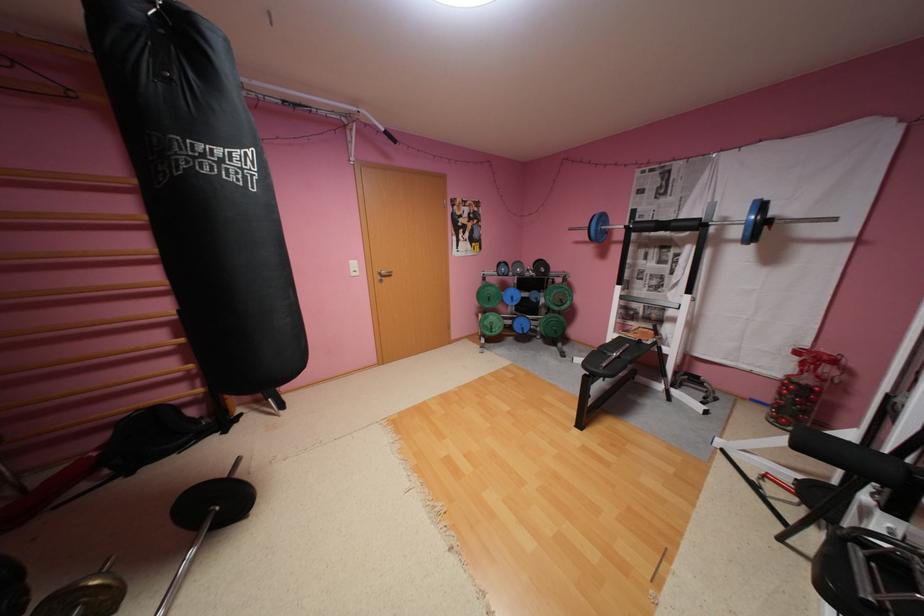
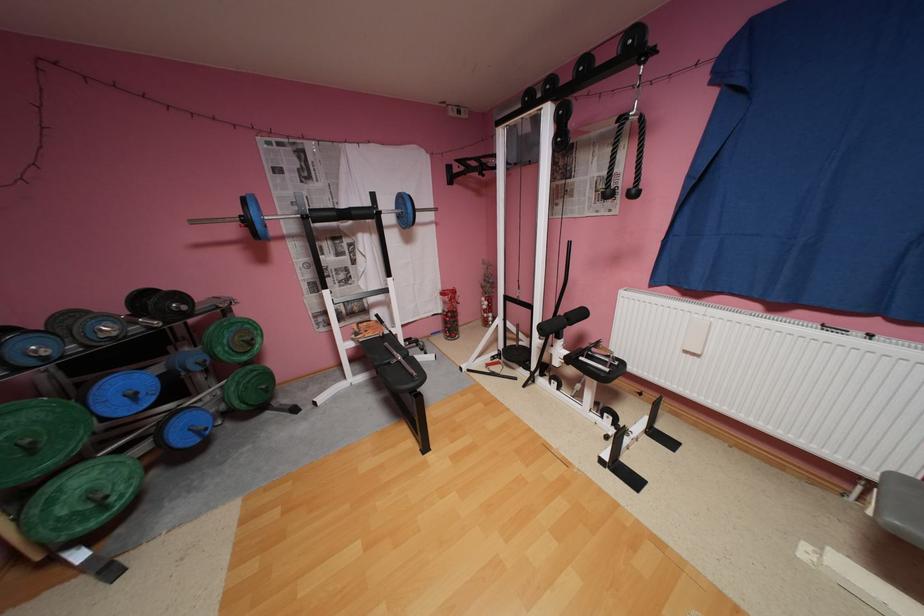
Locate, in the second image, the point that corresponds to pixel 640 336 in the first image.

(380, 334)